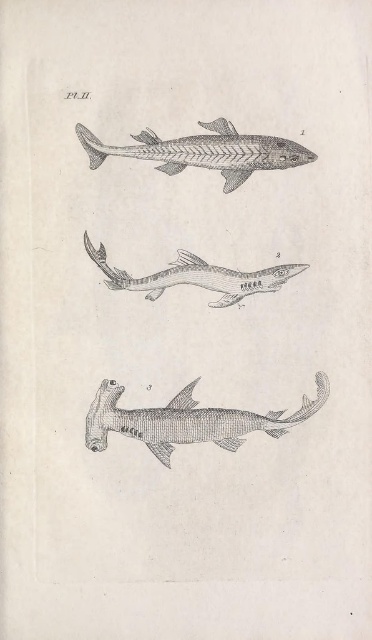
You are standing at a point 4.15 feet away from the point labeled as point (158, 417) in the image. If you want to move closer to that point, which direction should you move?

You should move towards the point labeled as point (158, 417) in the image since you are currently 4.15 feet away from it.

You are a marine biologist examining the illustration. You need to determine which shark is larger based on their positions. The sharks in question are the gray textured hammerhead shark at bottom and the gray textured shark at center. Which one is larger?

The gray textured hammerhead shark at bottom is bigger than the gray textured shark at center according to the illustration.